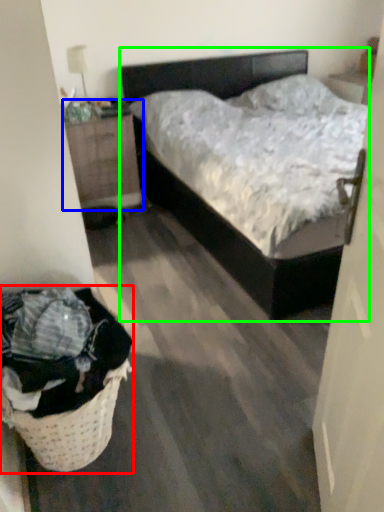
Question: Which is nearer to the laundry basket (highlighted by a red box)? nightstand (highlighted by a blue box) or bed (highlighted by a green box).

Choices:
 (A) nightstand
 (B) bed

Answer: (B)